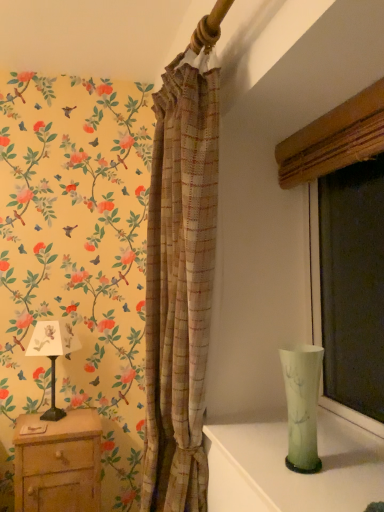
Locate an element on the screen. This screenshot has height=512, width=384. vacant area that is situated to the right of green translucent vase at right is located at coordinates (350, 470).